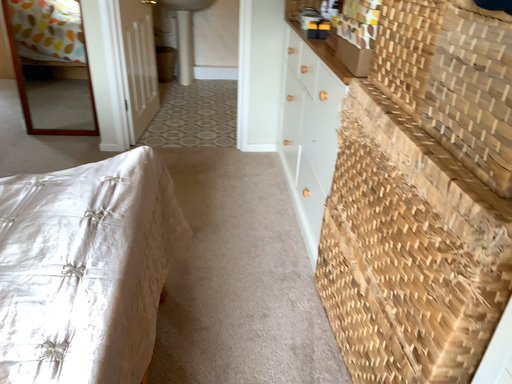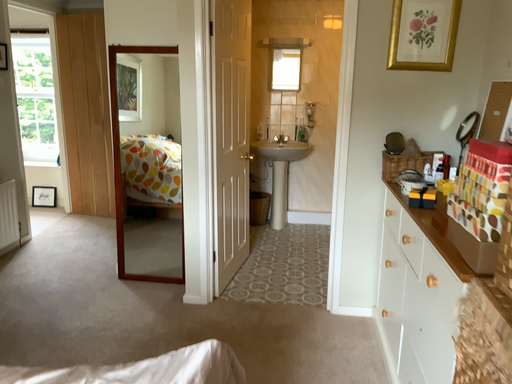
Question: How did the camera likely rotate when shooting the video?

Choices:
 (A) rotated left
 (B) rotated right

Answer: (A)